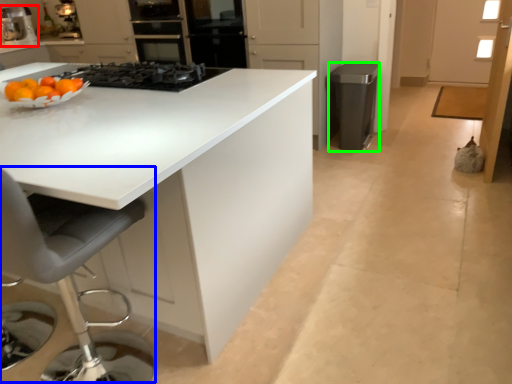
Question: Considering the real-world distances, which object is closest to home appliance (highlighted by a red box)? swivel chair (highlighted by a blue box) or appliance (highlighted by a green box).

Choices:
 (A) swivel chair
 (B) appliance

Answer: (B)